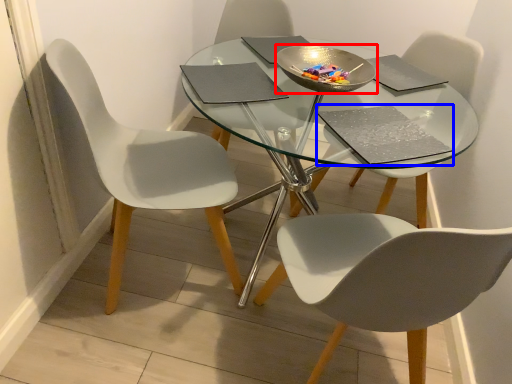
Question: Which of the following is the closest to the observer, bowl (highlighted by a red box) or pad (highlighted by a blue box)?

Choices:
 (A) bowl
 (B) pad

Answer: (B)